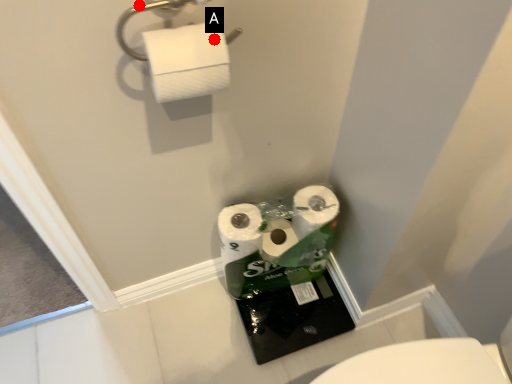
Question: Two points are circled on the image, labeled by A and B beside each circle. Which of the following is the farthest from the observer?

Choices:
 (A) A is further
 (B) B is further

Answer: (A)